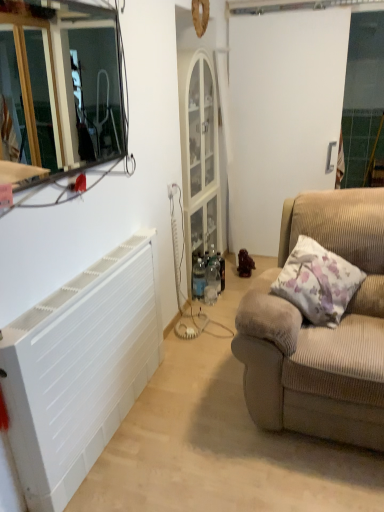
Where is `free space between beige corduroy couch at right and white plastic radiator at left`? This screenshot has height=512, width=384. free space between beige corduroy couch at right and white plastic radiator at left is located at coordinates (208, 431).